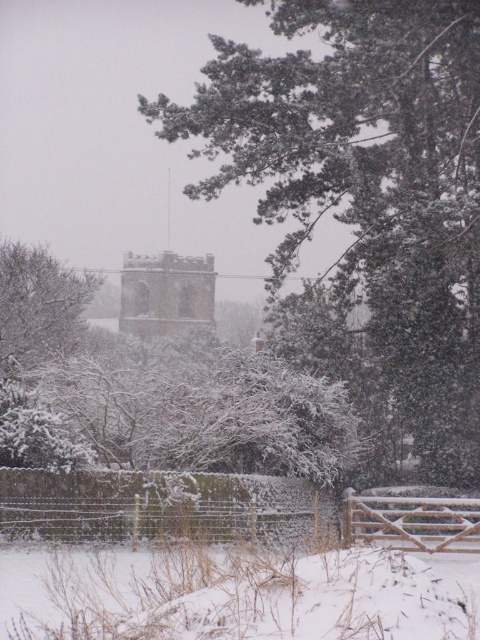
Question: Is snow-covered tree at center behind snow-covered wooden fence at lower center?

Choices:
 (A) no
 (B) yes

Answer: (B)

Question: Which object is positioned closest to the snow-covered tree at center?

Choices:
 (A) green textured tree at upper center
 (B) brown stone tower at center
 (C) snow-covered wooden fence at lower center

Answer: (A)

Question: Based on their relative distances, which object is nearer to the green textured tree at upper center?

Choices:
 (A) snow-covered wooden fence at lower center
 (B) brown stone tower at center

Answer: (A)

Question: In this image, where is snow-covered tree at center located relative to brown stone tower at center?

Choices:
 (A) above
 (B) below

Answer: (B)

Question: Based on their relative distances, which object is farther from the snow-covered tree at center?

Choices:
 (A) green textured tree at upper center
 (B) brown stone tower at center

Answer: (B)

Question: Is green textured tree at upper center above snow-covered wooden fence at lower center?

Choices:
 (A) yes
 (B) no

Answer: (A)